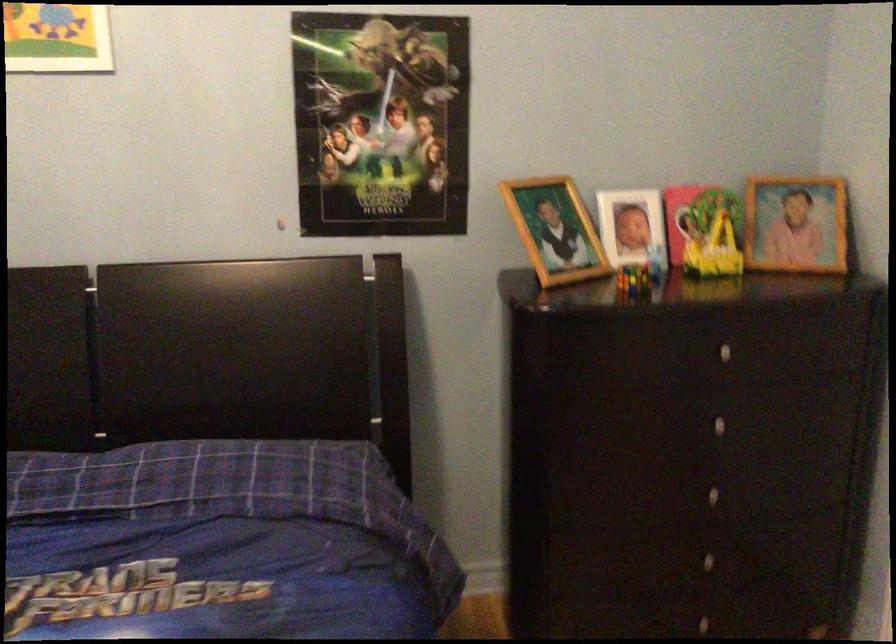
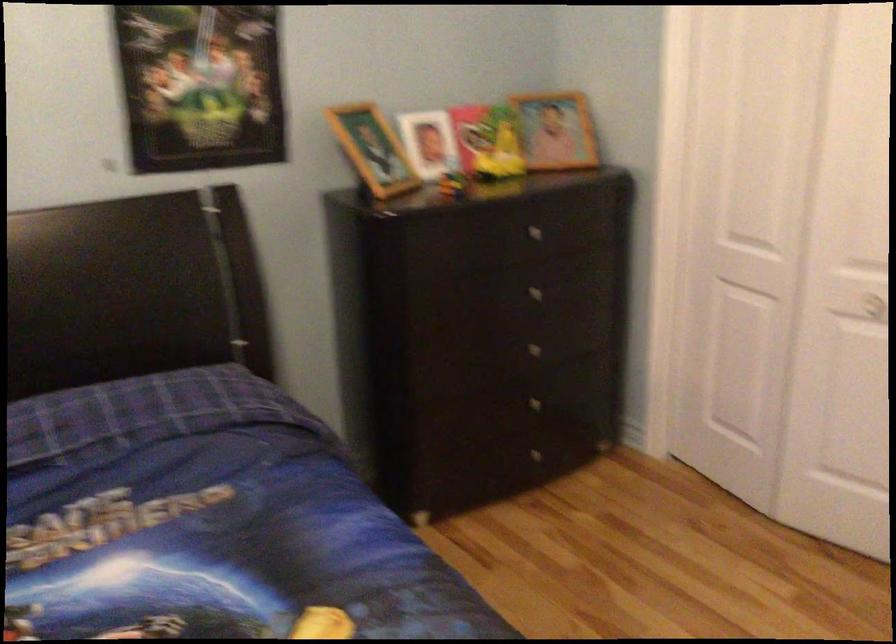
Locate, in the second image, the point that corresponds to the point at 556,232 in the first image.

(373, 149)